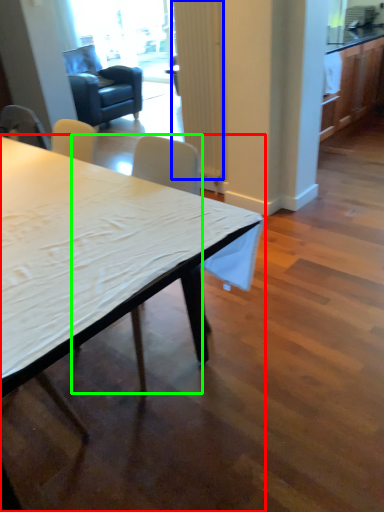
Question: Based on their relative distances, which object is nearer to desk (highlighted by a red box)? Choose from curtain (highlighted by a blue box) and chair (highlighted by a green box).

Choices:
 (A) curtain
 (B) chair

Answer: (B)